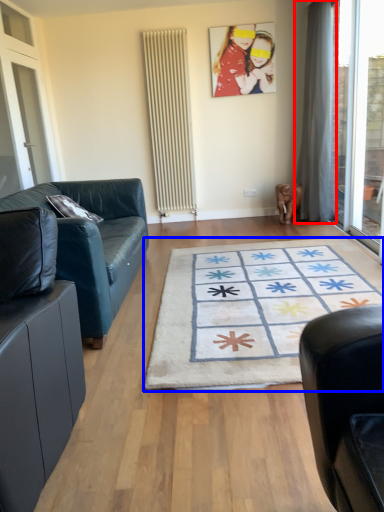
Question: Which object appears closest to the camera in this image, curtain (highlighted by a red box) or mat (highlighted by a blue box)?

Choices:
 (A) curtain
 (B) mat

Answer: (B)